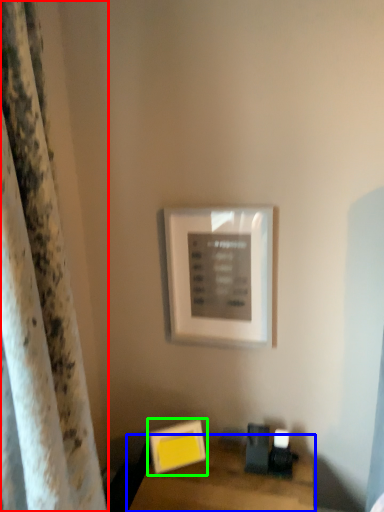
Question: Estimate the real-world distances between objects in this image. Which object is closer to curtain (highlighted by a red box), table (highlighted by a blue box) or picture frame (highlighted by a green box)?

Choices:
 (A) table
 (B) picture frame

Answer: (A)